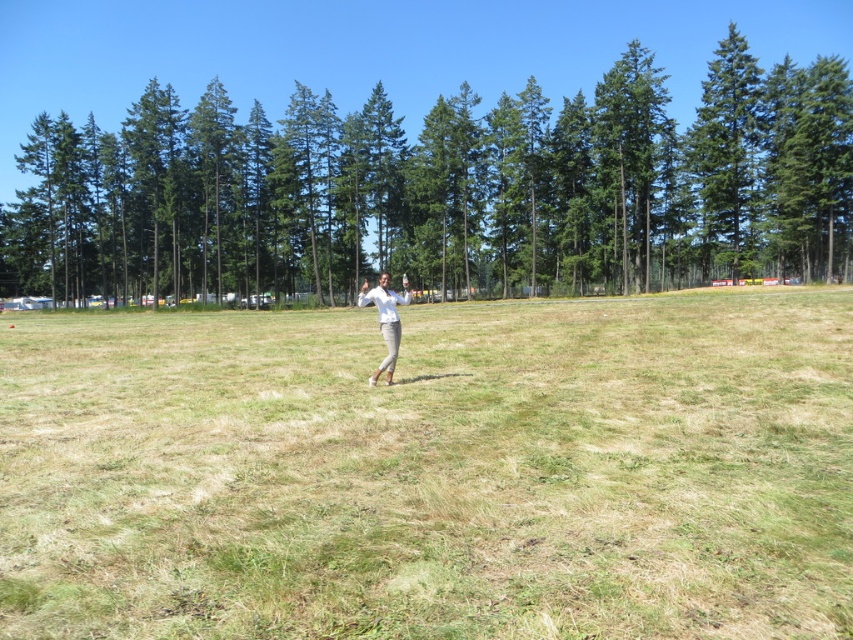
How much distance is there between green textured tree at center and white matte pants at center?

green textured tree at center is 27.89 meters from white matte pants at center.

Does point (677, 141) come farther from viewer compared to point (381, 301)?

Yes, point (677, 141) is behind point (381, 301).

At what (x,y) coordinates should I click in order to perform the action: click on green textured tree at center. Please return your answer as a coordinate pair (x, y). This screenshot has width=853, height=640. Looking at the image, I should click on (444, 189).

The height and width of the screenshot is (640, 853). Find the location of `green textured tree at center`. green textured tree at center is located at coordinates (444, 189).

Which is more to the right, green dry grass at center or white matte pants at center?

green dry grass at center is more to the right.

Does green dry grass at center have a lesser height compared to white matte pants at center?

Indeed, green dry grass at center has a lesser height compared to white matte pants at center.

The width and height of the screenshot is (853, 640). What do you see at coordinates (432, 472) in the screenshot?
I see `green dry grass at center` at bounding box center [432, 472].

Where is `green dry grass at center`? The height and width of the screenshot is (640, 853). green dry grass at center is located at coordinates (432, 472).

Can you confirm if green dry grass at center is wider than green textured tree at center?

No, green dry grass at center is not wider than green textured tree at center.

Looking at this image, which of these two, green dry grass at center or green textured tree at center, stands taller?

Standing taller between the two is green textured tree at center.

Does point (436, 492) come closer to viewer compared to point (485, 122)?

Yes, it is in front of point (485, 122).

Locate an element on the screen. green dry grass at center is located at coordinates (432, 472).